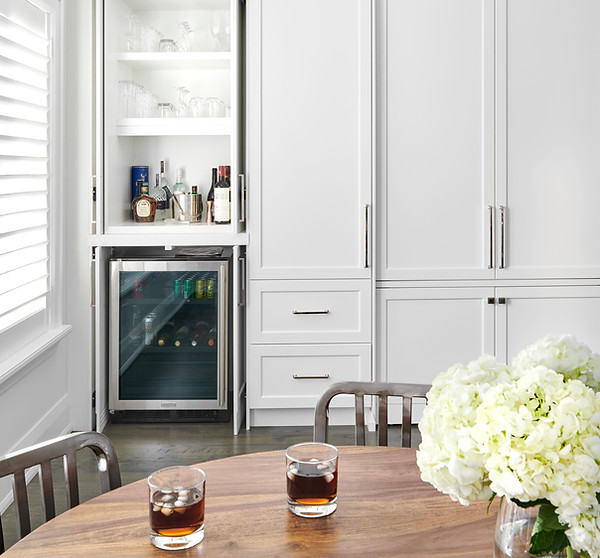
This screenshot has width=600, height=558. I want to click on chair, so click(x=356, y=389), click(x=47, y=459).